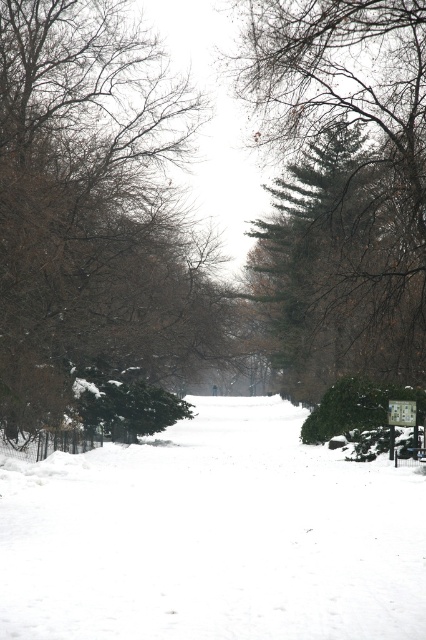
Does white powdery snow at center have a lesser height compared to brown/dry wood tree at center?

Correct, white powdery snow at center is not as tall as brown/dry wood tree at center.

Is point (374, 600) positioned after point (109, 323)?

No, (374, 600) is closer to viewer.

The width and height of the screenshot is (426, 640). What are the coordinates of `white powdery snow at center` in the screenshot? It's located at (213, 536).

The width and height of the screenshot is (426, 640). What do you see at coordinates (94, 209) in the screenshot? I see `brown/dry wood tree at center` at bounding box center [94, 209].

Is the position of brown/dry wood tree at center more distant than that of metallic silver sign at center?

No, brown/dry wood tree at center is in front of metallic silver sign at center.

Which is in front, point (192, 106) or point (411, 420)?

Positioned in front is point (411, 420).

The width and height of the screenshot is (426, 640). Identify the location of brown/dry wood tree at center. (94, 209).

Between point (210, 628) and point (396, 420), which one is positioned in front?

Point (210, 628) is in front.

This screenshot has width=426, height=640. What do you see at coordinates (213, 536) in the screenshot? I see `white powdery snow at center` at bounding box center [213, 536].

Who is more distant from viewer, (288, 435) or (416, 420)?

Positioned behind is point (288, 435).

Where is `white powdery snow at center`? The width and height of the screenshot is (426, 640). white powdery snow at center is located at coordinates (213, 536).